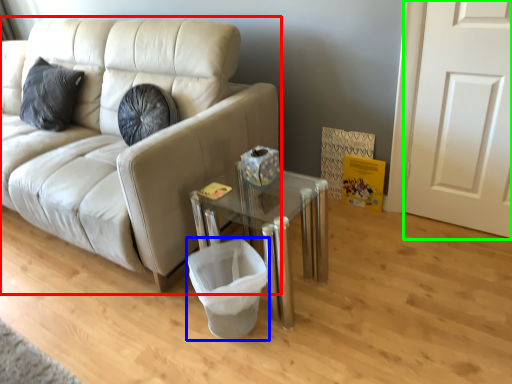
Question: Based on their relative distances, which object is farther from studio couch (highlighted by a red box)? Choose from laundry basket (highlighted by a blue box) and door (highlighted by a green box).

Choices:
 (A) laundry basket
 (B) door

Answer: (B)